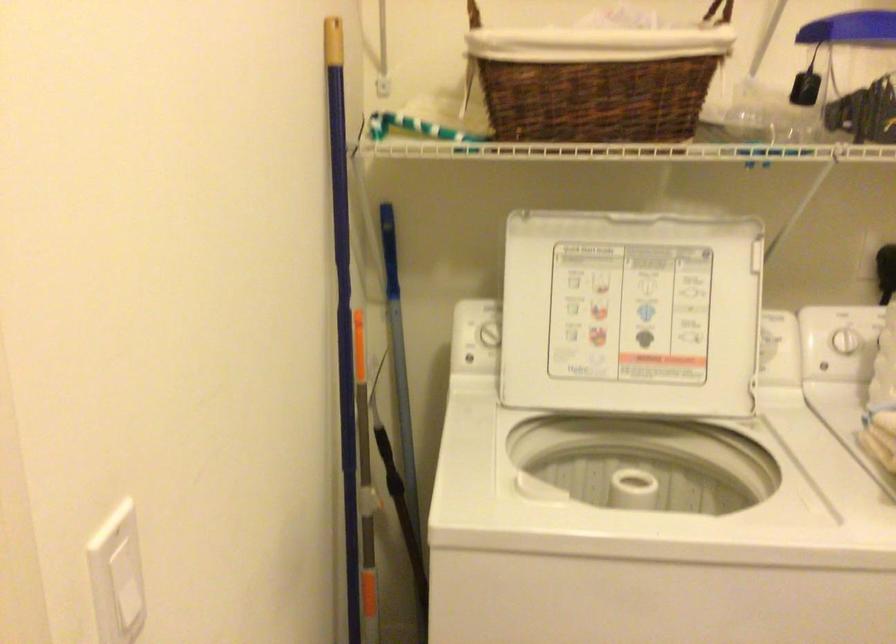
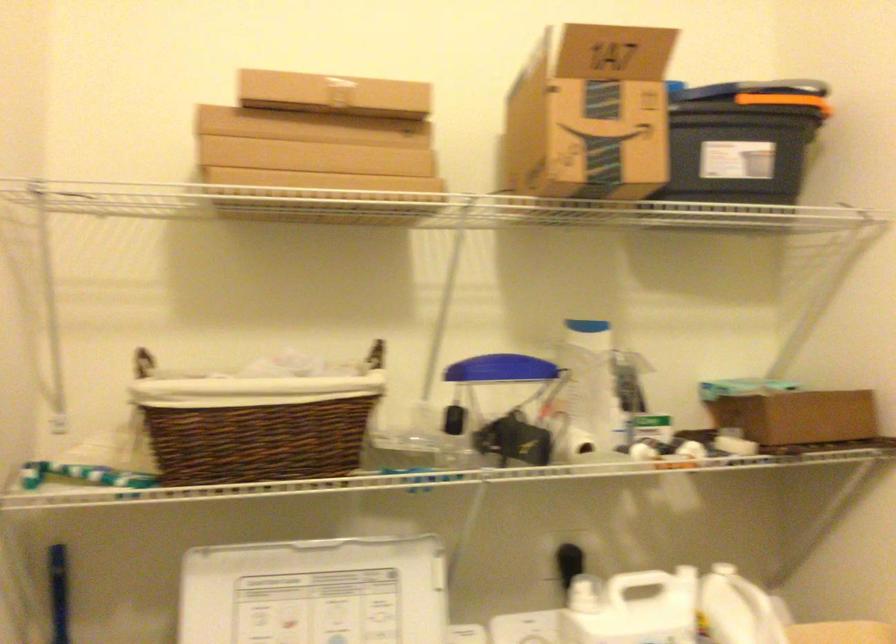
First-person continuous shooting, in which direction is the camera rotating?

The rotation direction of the camera is right-up.